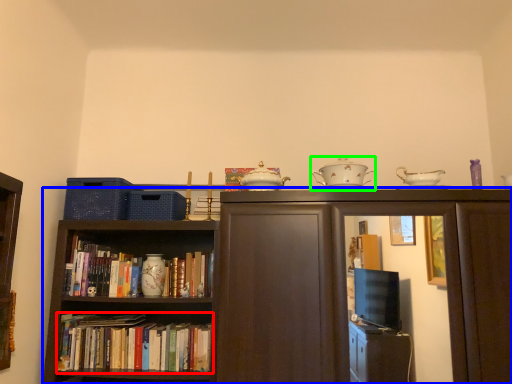
Question: Estimate the real-world distances between objects in this image. Which object is farther from book (highlighted by a red box), bookcase (highlighted by a blue box) or tableware (highlighted by a green box)?

Choices:
 (A) bookcase
 (B) tableware

Answer: (B)